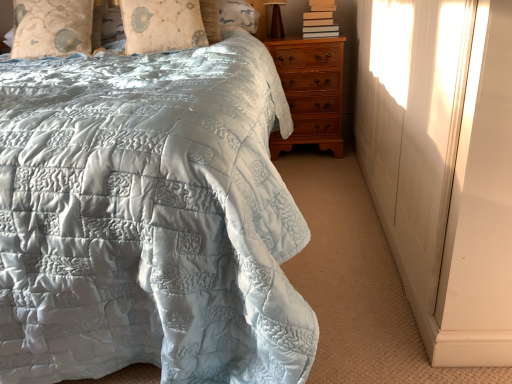
Question: Is brown wooden table lamp at upper right behind silky beige pillow at upper center, arranged as the second pillow when viewed from the left?

Choices:
 (A) yes
 (B) no

Answer: (A)

Question: Is silky beige pillow at upper center, the 1th pillow in the right-to-left sequence, a part of brown wooden table lamp at upper right?

Choices:
 (A) yes
 (B) no

Answer: (B)

Question: Could you tell me if brown wooden table lamp at upper right is turned towards silky beige pillow at upper center, arranged as the second pillow when viewed from the left?

Choices:
 (A) no
 (B) yes

Answer: (A)

Question: From a real-world perspective, is brown wooden table lamp at upper right positioned under silky beige pillow at upper center, arranged as the second pillow when viewed from the left, based on gravity?

Choices:
 (A) yes
 (B) no

Answer: (B)

Question: Is brown wooden table lamp at upper right at the right side of silky beige pillow at upper center, the 1th pillow in the right-to-left sequence?

Choices:
 (A) no
 (B) yes

Answer: (B)

Question: In terms of height, does light brown wood chest of drawers at right look taller or shorter compared to light blue quilted pillow at upper left, marked as the 2th pillow in a right-to-left arrangement?

Choices:
 (A) tall
 (B) short

Answer: (A)

Question: Is light brown wood chest of drawers at right to the left or to the right of light blue quilted pillow at upper left, arranged as the first pillow when viewed from the left, in the image?

Choices:
 (A) right
 (B) left

Answer: (A)

Question: From the image's perspective, is light brown wood chest of drawers at right above or below light blue quilted pillow at upper left, arranged as the first pillow when viewed from the left?

Choices:
 (A) below
 (B) above

Answer: (A)

Question: From a real-world perspective, relative to light blue quilted pillow at upper left, marked as the 2th pillow in a right-to-left arrangement, is light brown wood chest of drawers at right vertically above or below?

Choices:
 (A) above
 (B) below

Answer: (B)

Question: Would you say hardcover books at upper right is inside or outside matte quilted bedspread at center?

Choices:
 (A) inside
 (B) outside

Answer: (B)

Question: From the image's perspective, is hardcover books at upper right above or below matte quilted bedspread at center?

Choices:
 (A) above
 (B) below

Answer: (A)

Question: Considering the positions of hardcover books at upper right and matte quilted bedspread at center in the image, is hardcover books at upper right bigger or smaller than matte quilted bedspread at center?

Choices:
 (A) big
 (B) small

Answer: (B)

Question: Based on their positions, is hardcover books at upper right located to the left or right of matte quilted bedspread at center?

Choices:
 (A) right
 (B) left

Answer: (A)

Question: Relative to hardcover books at upper right, is brown wooden table lamp at upper right in front or behind?

Choices:
 (A) front
 (B) behind

Answer: (B)

Question: Based on their sizes in the image, would you say brown wooden table lamp at upper right is bigger or smaller than hardcover books at upper right?

Choices:
 (A) small
 (B) big

Answer: (A)